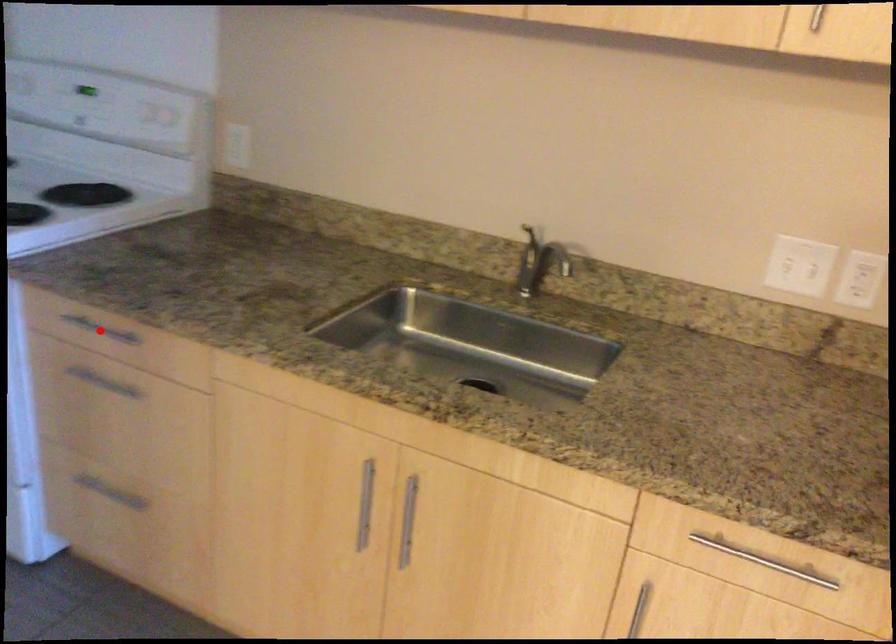
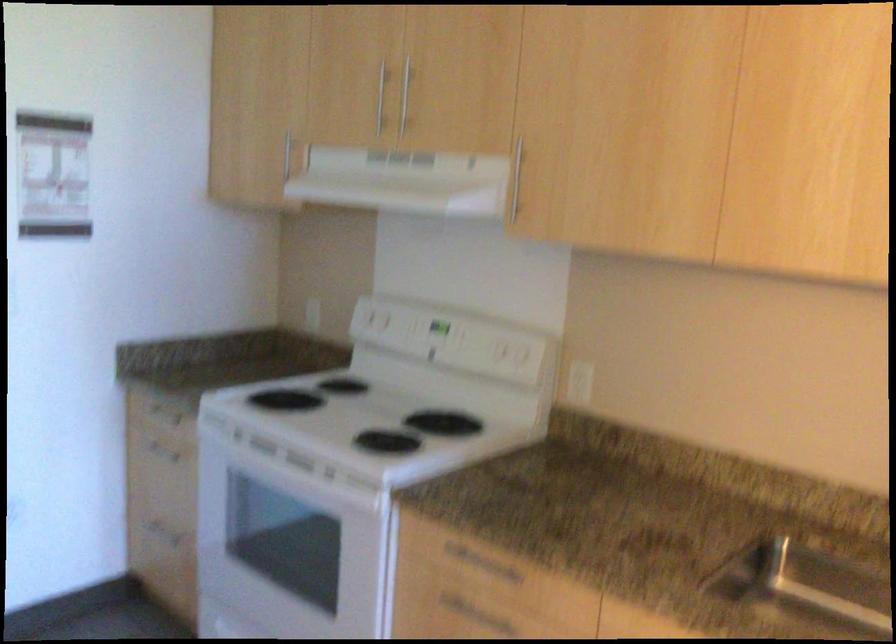
The point at the highlighted location is marked in the first image. Where is the corresponding point in the second image?

(480, 564)